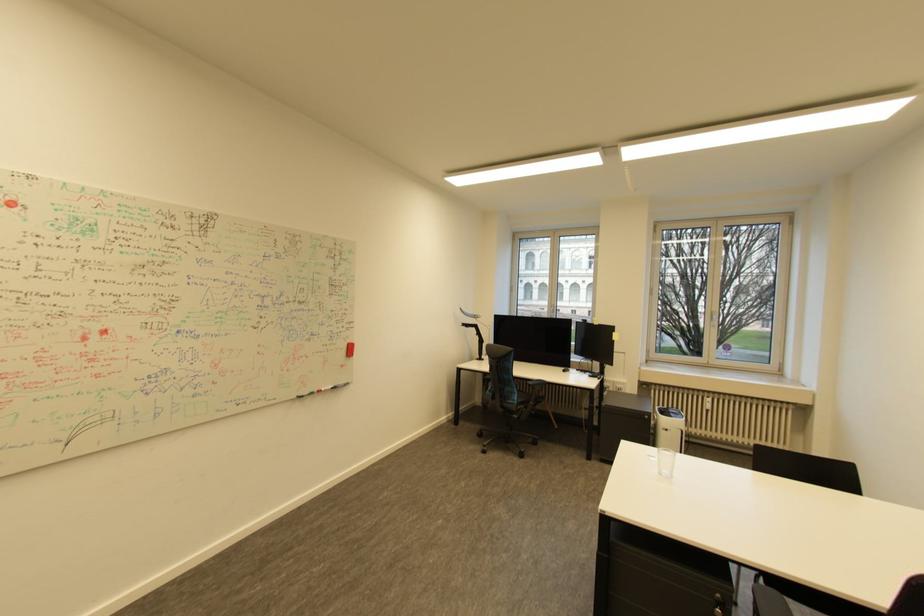
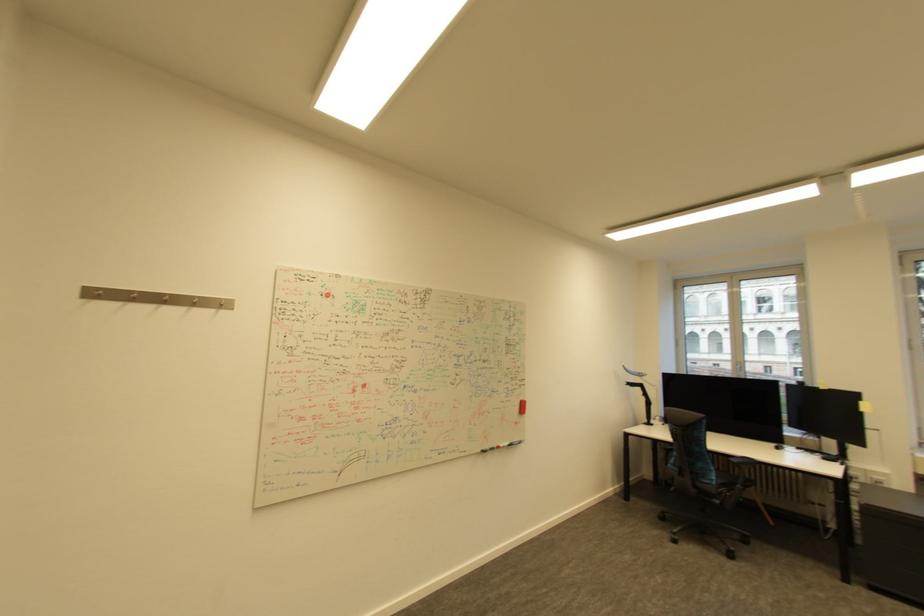
Question: The camera is either moving clockwise (left) or counter-clockwise (right) around the object. The first image is from the beginning of the video and the second image is from the end. Is the camera moving left or right when shooting the video?

Choices:
 (A) Left
 (B) Right

Answer: (B)